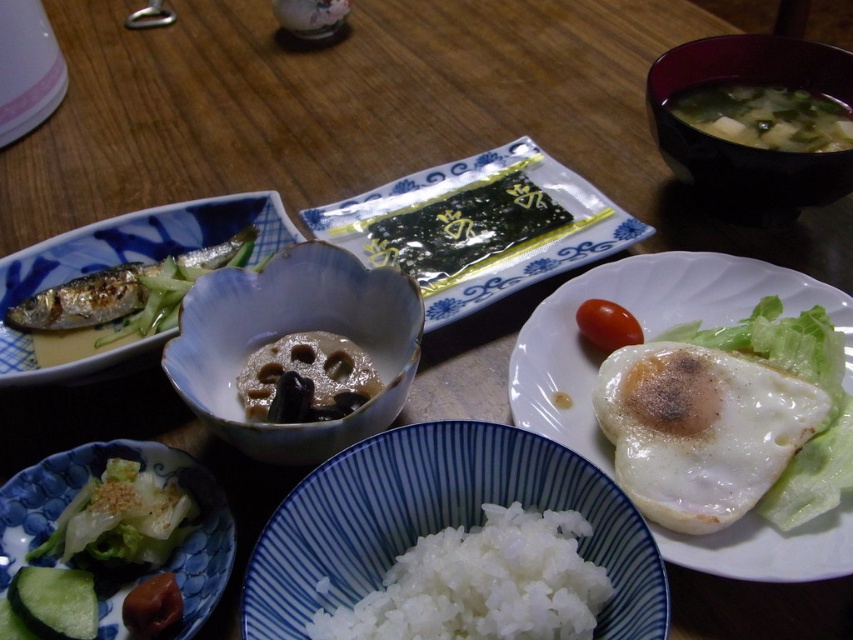
Who is taller, green leafy vegetable at lower left or green leafy vegetable soup at upper right?

With more height is green leafy vegetable soup at upper right.

Locate an element on the screen. The width and height of the screenshot is (853, 640). green leafy vegetable at lower left is located at coordinates (120, 518).

Who is lower down, matte ceramic bowl at upper right or green leafy vegetable soup at upper right?

matte ceramic bowl at upper right

Is point (840, 177) farther from camera compared to point (781, 113)?

No, it is in front of (781, 113).

Between point (763, 186) and point (695, 129), which one is positioned behind?

Positioned behind is point (695, 129).

Identify the location of matte ceramic bowl at upper right. The height and width of the screenshot is (640, 853). (741, 145).

Can you confirm if green smooth cucumber at lower left is bigger than red matte tomato at center?

No, green smooth cucumber at lower left is not bigger than red matte tomato at center.

Does green smooth cucumber at lower left have a lesser height compared to red matte tomato at center?

Indeed, green smooth cucumber at lower left has a lesser height compared to red matte tomato at center.

Is point (44, 616) behind point (589, 333)?

No, it is in front of (589, 333).

Identify the location of green smooth cucumber at lower left. (55, 602).